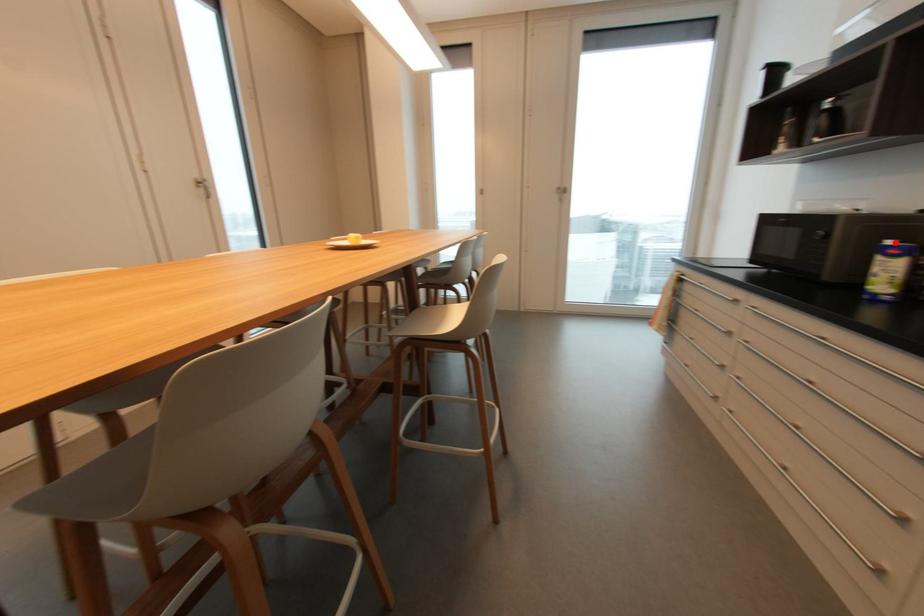
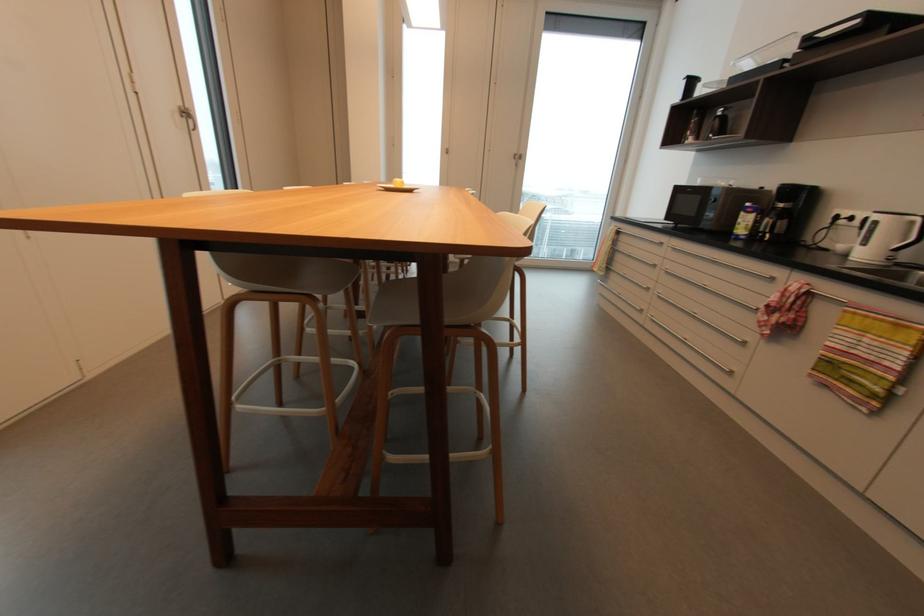
In the second image, find the point that corresponds to the highlighted location in the first image.

(750, 205)